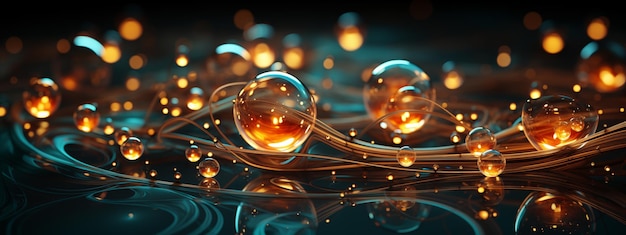
Identify the location of abstract art image. (441, 184).